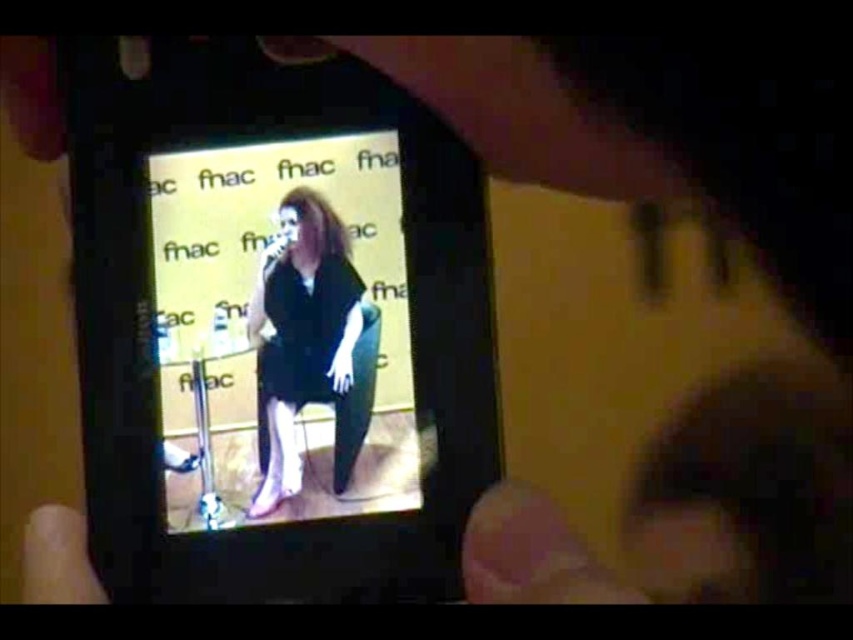
Question: Can you confirm if matte black dress at center is thinner than smooth skin hand at lower left?

Choices:
 (A) yes
 (B) no

Answer: (B)

Question: Among these objects, which one is farthest from the camera?

Choices:
 (A) smooth skin hand at lower left
 (B) matte black dress at center

Answer: (B)

Question: Which point is farther to the camera?

Choices:
 (A) (260, 362)
 (B) (77, 589)

Answer: (A)

Question: From the image, what is the correct spatial relationship of matte black dress at center in relation to smooth skin hand at lower left?

Choices:
 (A) above
 (B) below

Answer: (A)

Question: Which object is farther from the camera taking this photo?

Choices:
 (A) smooth skin hand at lower left
 (B) matte black dress at center

Answer: (B)

Question: Can you confirm if matte black dress at center is wider than smooth skin hand at lower left?

Choices:
 (A) yes
 (B) no

Answer: (A)